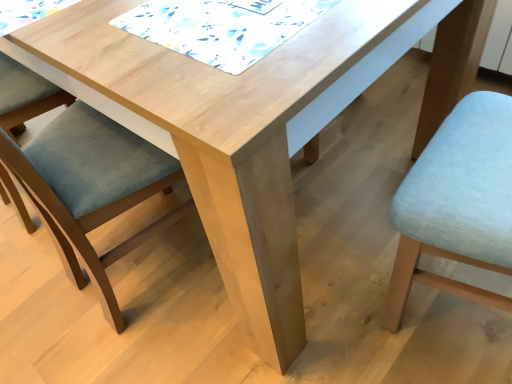
The width and height of the screenshot is (512, 384). I want to click on free space in front of white printed fabric at upper center, so click(x=266, y=69).